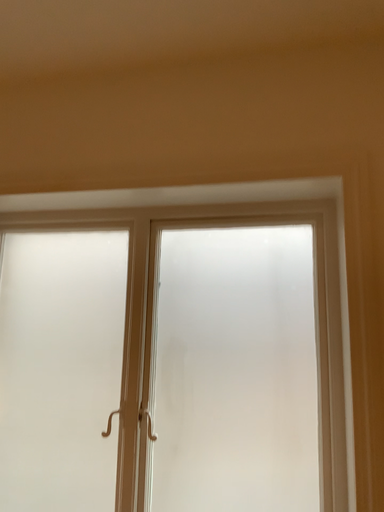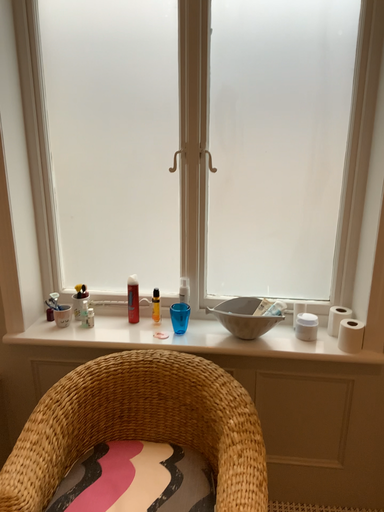
Question: How did the camera likely rotate when shooting the video?

Choices:
 (A) rotated upward
 (B) rotated downward

Answer: (B)